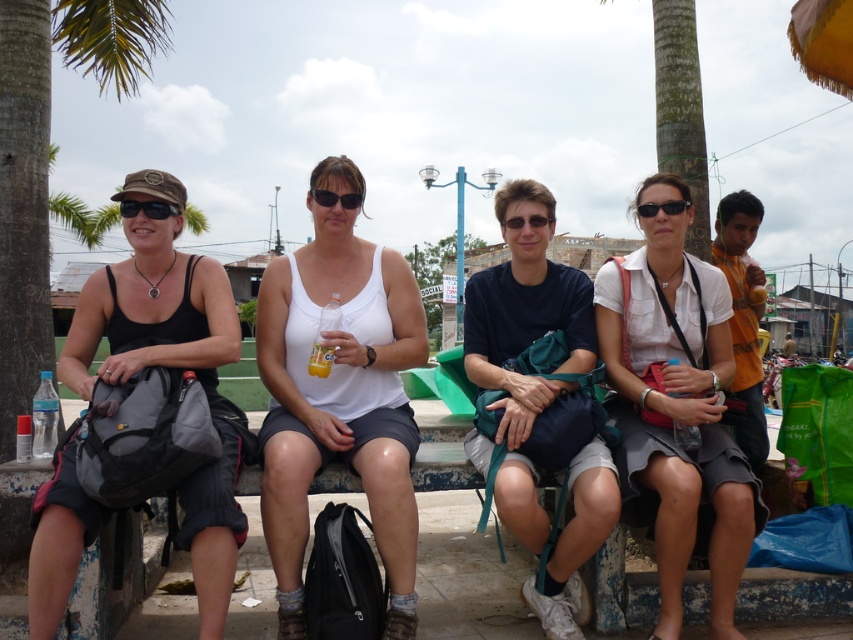
This screenshot has height=640, width=853. What do you see at coordinates (335, 198) in the screenshot?
I see `matte white sunglasses at center` at bounding box center [335, 198].

Identify the location of matte white sunglasses at center. The image size is (853, 640). (335, 198).

The image size is (853, 640). What do you see at coordinates (335, 198) in the screenshot?
I see `matte white sunglasses at center` at bounding box center [335, 198].

Where is `matte white sunglasses at center`? matte white sunglasses at center is located at coordinates (335, 198).

Is point (303, 422) closer to camera compared to point (671, 397)?

Yes, point (303, 422) is in front of point (671, 397).

Does white matte tank top at center appear on the left side of white matte shirt at center?

Correct, you'll find white matte tank top at center to the left of white matte shirt at center.

Between point (267, 321) and point (630, 468), which one is positioned behind?

The point (267, 321) is more distant.

Locate an element on the screen. white matte tank top at center is located at coordinates (339, 403).

Looking at this image, does matte black sunglasses at left have a larger size compared to matte white sunglasses at center?

Yes, matte black sunglasses at left is bigger than matte white sunglasses at center.

Between point (160, 205) and point (321, 198), which one is positioned behind?

The point (321, 198) is more distant.

At what (x,y) coordinates should I click in order to perform the action: click on matte black sunglasses at left. Please return your answer as a coordinate pair (x, y). Image resolution: width=853 pixels, height=640 pixels. Looking at the image, I should click on (148, 209).